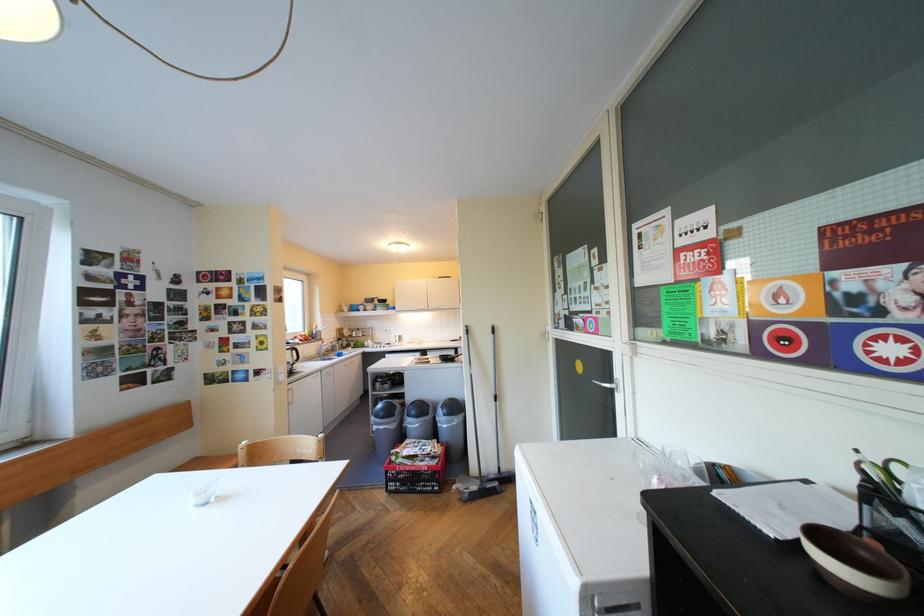
What do you see at coordinates (494, 397) in the screenshot? I see `the black broom handle` at bounding box center [494, 397].